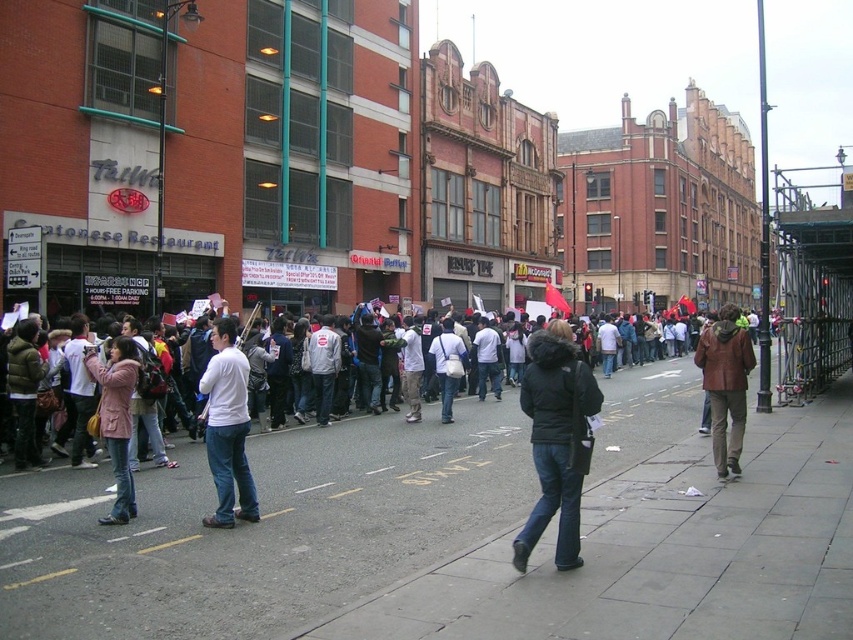
Question: Which object is the closest to the white fabric bag at center?

Choices:
 (A) gray concrete sidewalk at lower center
 (B) black fur-trimmed jacket at center

Answer: (A)

Question: Is gray concrete sidewalk at lower center to the right of white matte shirt at center from the viewer's perspective?

Choices:
 (A) yes
 (B) no

Answer: (A)

Question: Is black fur-trimmed jacket at center further to camera compared to white matte shirt at center?

Choices:
 (A) yes
 (B) no

Answer: (B)

Question: Does gray concrete sidewalk at lower center appear over white fabric bag at center?

Choices:
 (A) yes
 (B) no

Answer: (B)

Question: Which object appears farthest from the camera in this image?

Choices:
 (A) white fabric bag at center
 (B) white matte shirt at center
 (C) brown leather jacket at right

Answer: (A)

Question: Which of the following is the closest to the observer?

Choices:
 (A) (456, 333)
 (B) (123, 461)

Answer: (B)